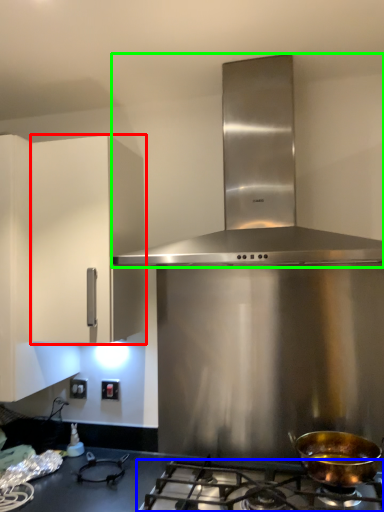
Question: Which is nearer to the cabinetry (highlighted by a red box)? gas stove (highlighted by a blue box) or home appliance (highlighted by a green box).

Choices:
 (A) gas stove
 (B) home appliance

Answer: (B)